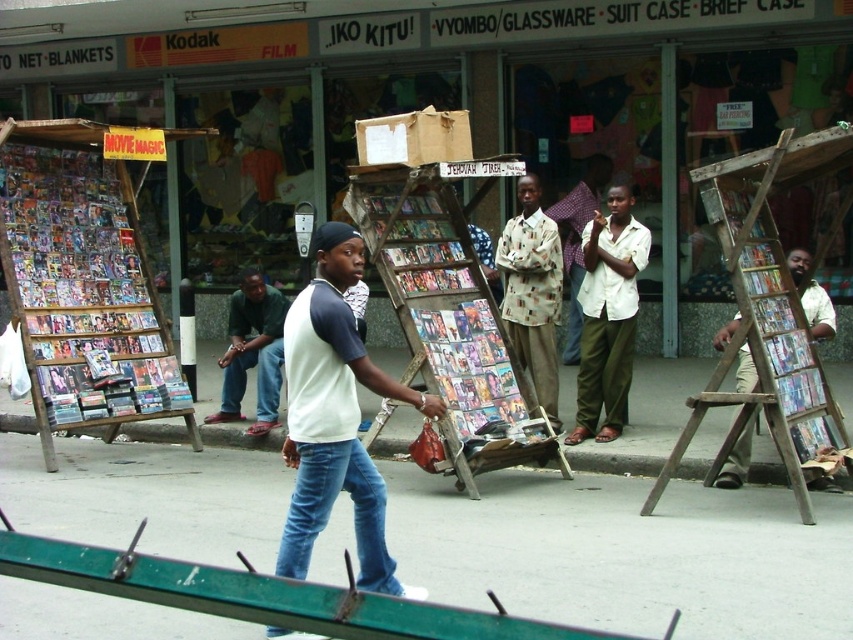
Question: Which of the following is the farthest from the observer?

Choices:
 (A) 323,490
 (B) 236,307

Answer: (B)

Question: Does concrete pavement at center have a greater width compared to white cotton shirt at center?

Choices:
 (A) yes
 (B) no

Answer: (B)

Question: Which point is closer to the camera?

Choices:
 (A) printed cotton shirt at center
 (B) concrete pavement at center
 (C) green fabric pants at center

Answer: (B)

Question: Is wooden/matte movie stand at left positioned in front of printed cotton shirt at center?

Choices:
 (A) no
 (B) yes

Answer: (B)

Question: Which object is farther from the camera taking this photo?

Choices:
 (A) wooden at center
 (B) white cotton shirt at center
 (C) denim at center

Answer: (A)

Question: Does wooden at right appear on the right side of white matte shirt at center?

Choices:
 (A) yes
 (B) no

Answer: (A)